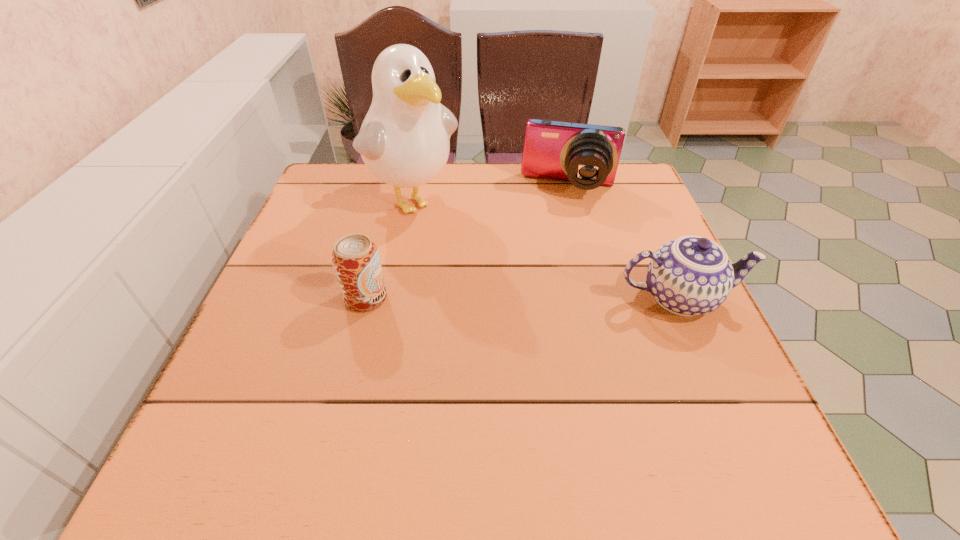
Where is `vacant space located 0.190m on the front-facing side of the camera`? vacant space located 0.190m on the front-facing side of the camera is located at coordinates (555, 252).

Where is `gull positioned at the far edge`? gull positioned at the far edge is located at coordinates (x=404, y=140).

Locate an element on the screen. Image resolution: width=960 pixels, height=540 pixels. camera present at the far edge is located at coordinates (587, 155).

This screenshot has width=960, height=540. In order to click on object present at the left edge in this screenshot , I will do `click(404, 140)`.

The image size is (960, 540). What are the coordinates of `chinaware at the right edge` in the screenshot? It's located at (691, 275).

In order to click on camera located at the right edge in this screenshot , I will do `click(587, 155)`.

Locate an element on the screen. object at the far left corner is located at coordinates (404, 140).

Where is `object that is at the far right corner`? This screenshot has height=540, width=960. object that is at the far right corner is located at coordinates (587, 155).

Identify the location of vacant space at the far edge of the desktop. (376, 208).

The image size is (960, 540). I want to click on vacant space at the left edge of the desktop, so click(282, 311).